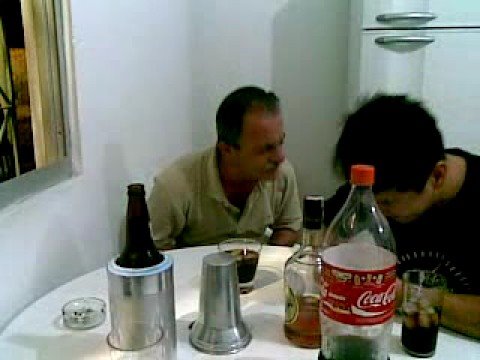
Generate point markers for all where you open the fridge in the image. Your answer should be formatted as a list of tuples, i.e. [(x1, y1), (x2, y2), ...], where each tuple contains the x and y coordinates of a point satisfying the conditions above.

[(402, 42)]